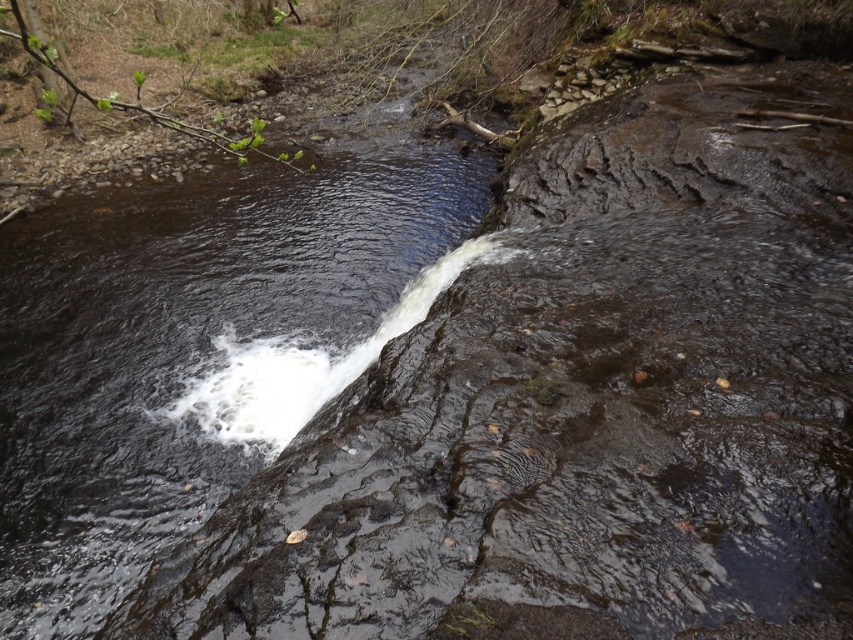
Question: Observing the image, what is the correct spatial positioning of dark wet rock at center in reference to white frothy water at center?

Choices:
 (A) above
 (B) below

Answer: (A)

Question: Does dark wet rock at center appear on the right side of white frothy water at center?

Choices:
 (A) no
 (B) yes

Answer: (A)

Question: Does dark wet rock at center appear over white frothy water at center?

Choices:
 (A) no
 (B) yes

Answer: (B)

Question: Which point is farther to the camera?

Choices:
 (A) (436, 264)
 (B) (190, 428)

Answer: (A)